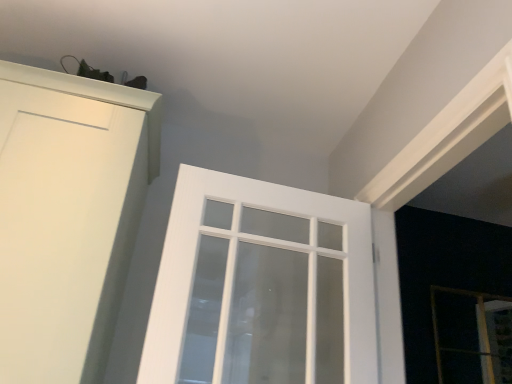
Question: Is transparent glass screen door at lower right at the right side of white textured glass door at center?

Choices:
 (A) yes
 (B) no

Answer: (A)

Question: From a real-world perspective, is transparent glass screen door at lower right beneath white textured glass door at center?

Choices:
 (A) yes
 (B) no

Answer: (B)

Question: Does transparent glass screen door at lower right have a greater height compared to white textured glass door at center?

Choices:
 (A) no
 (B) yes

Answer: (A)

Question: Does transparent glass screen door at lower right turn towards white textured glass door at center?

Choices:
 (A) yes
 (B) no

Answer: (B)

Question: Considering the relative sizes of transparent glass screen door at lower right and white textured glass door at center in the image provided, is transparent glass screen door at lower right wider than white textured glass door at center?

Choices:
 (A) no
 (B) yes

Answer: (A)

Question: Is transparent glass screen door at lower right far from white textured glass door at center?

Choices:
 (A) no
 (B) yes

Answer: (A)

Question: Is the position of white textured glass door at center less distant than that of transparent glass screen door at lower right?

Choices:
 (A) no
 (B) yes

Answer: (B)

Question: Can you confirm if white textured glass door at center is positioned to the right of transparent glass screen door at lower right?

Choices:
 (A) no
 (B) yes

Answer: (A)

Question: Considering the relative sizes of white textured glass door at center and transparent glass screen door at lower right in the image provided, is white textured glass door at center smaller than transparent glass screen door at lower right?

Choices:
 (A) no
 (B) yes

Answer: (A)

Question: Considering the relative sizes of white textured glass door at center and transparent glass screen door at lower right in the image provided, is white textured glass door at center wider than transparent glass screen door at lower right?

Choices:
 (A) no
 (B) yes

Answer: (B)

Question: From the image's perspective, is white textured glass door at center on transparent glass screen door at lower right?

Choices:
 (A) no
 (B) yes

Answer: (B)

Question: Considering the relative positions of white textured glass door at center and transparent glass screen door at lower right in the image provided, is white textured glass door at center to the left of transparent glass screen door at lower right from the viewer's perspective?

Choices:
 (A) no
 (B) yes

Answer: (B)

Question: From a real-world perspective, is white textured glass door at center positioned above or below transparent glass screen door at lower right?

Choices:
 (A) above
 (B) below

Answer: (B)